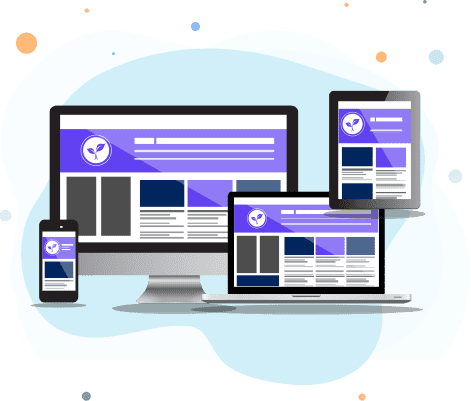
The height and width of the screenshot is (401, 471). What are the coordinates of `mockup of a tablet` in the screenshot? It's located at pyautogui.click(x=378, y=168).